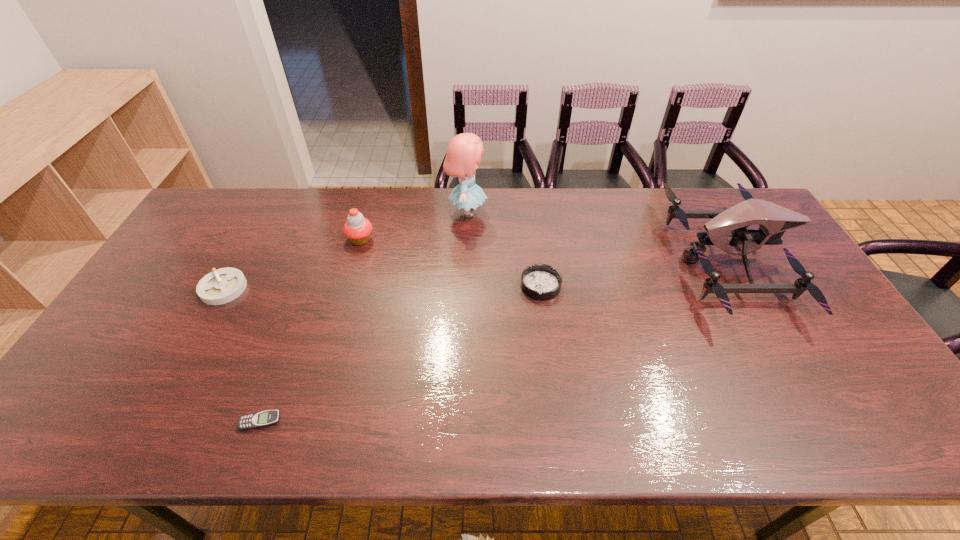
Identify the location of doll. The width and height of the screenshot is (960, 540). (464, 151).

At what (x,y) coordinates should I click in order to perform the action: click on the fourth object from left to right. Please return your answer as a coordinate pair (x, y). The image size is (960, 540). Looking at the image, I should click on (464, 151).

The image size is (960, 540). What are the coordinates of `drone` in the screenshot? It's located at (774, 220).

What are the coordinates of `the rightmost object` in the screenshot? It's located at (774, 220).

You are a GUI agent. You are given a task and a screenshot of the screen. Output one action in this format:
    pyautogui.click(x=<x>, y=<y>)
    Task: Click on the fourth shortest object
    
    Given the screenshot: What is the action you would take?
    pyautogui.click(x=358, y=229)

Where is `the third object from left to right`? The height and width of the screenshot is (540, 960). the third object from left to right is located at coordinates (358, 229).

Image resolution: width=960 pixels, height=540 pixels. What are the coordinates of `the leftmost object` in the screenshot? It's located at (223, 285).

This screenshot has width=960, height=540. What are the coordinates of `the second object from right to left` in the screenshot? It's located at (541, 282).

The width and height of the screenshot is (960, 540). I want to click on the shortest object, so click(x=266, y=418).

Where is `beeper`? beeper is located at coordinates (266, 418).